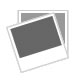
Identify the location of photographs. (34, 35), (60, 18).